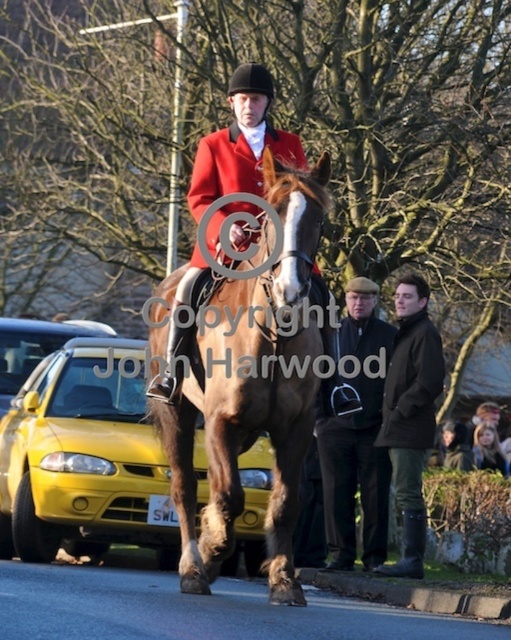
Between point (413, 436) and point (473, 451), which one is positioned behind?

Point (473, 451)

Does dark brown leather jacket at lower right have a greater width compared to blonde hair at center?

No, dark brown leather jacket at lower right is not wider than blonde hair at center.

Who is more distant from viewer, (x=410, y=333) or (x=499, y=458)?

The point (x=499, y=458) is behind.

Where is `dark brown leather jacket at lower right`? The width and height of the screenshot is (511, 640). dark brown leather jacket at lower right is located at coordinates [410, 416].

Does point (284, 182) come farther from viewer compared to point (429, 356)?

That is False.

Does brown glossy horse at center have a lesser height compared to dark brown leather jacket at lower right?

No, brown glossy horse at center is not shorter than dark brown leather jacket at lower right.

What do you see at coordinates (250, 392) in the screenshot? I see `brown glossy horse at center` at bounding box center [250, 392].

The height and width of the screenshot is (640, 511). I want to click on brown glossy horse at center, so click(x=250, y=392).

Does yellow matte taxi at left have a lesser width compared to matte red jacket at center?

In fact, yellow matte taxi at left might be wider than matte red jacket at center.

Based on the photo, who is taller, yellow matte taxi at left or matte red jacket at center?

matte red jacket at center

Where is `yellow matte taxi at left`? The width and height of the screenshot is (511, 640). yellow matte taxi at left is located at coordinates (83, 456).